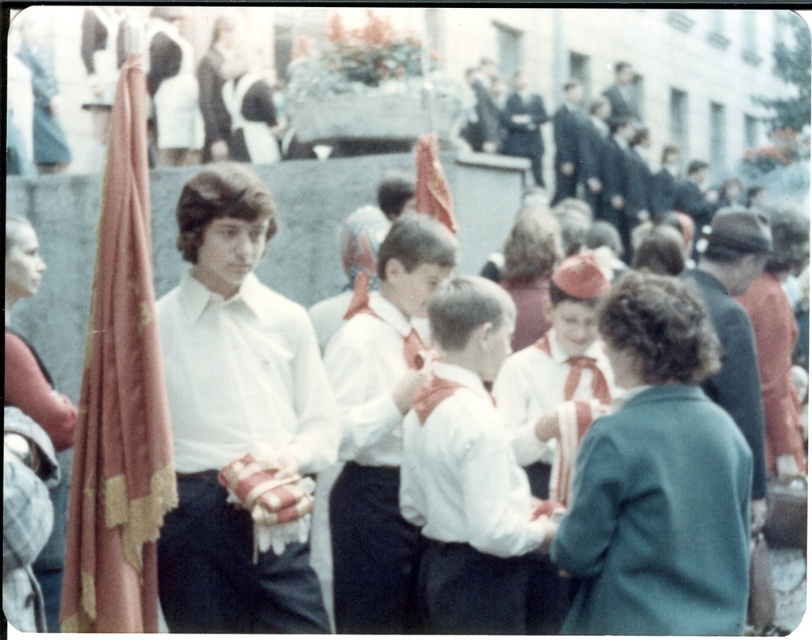
Question: Is green wool coat at center thinner than dark blue suit at upper center?

Choices:
 (A) yes
 (B) no

Answer: (B)

Question: Which object appears closest to the camera in this image?

Choices:
 (A) white satin bow tie at center
 (B) white cotton shirt at center
 (C) dark blue suit at center

Answer: (A)

Question: Which point is farther from the camera taking this photo?

Choices:
 (A) (441, 620)
 (B) (240, 349)
 (C) (340, 381)
 (D) (733, 388)

Answer: (D)

Question: Can you confirm if dark blue suit at upper center is positioned to the left of dark blue suit at center?

Choices:
 (A) no
 (B) yes

Answer: (B)

Question: Which point is closer to the camera?

Choices:
 (A) green wool coat at center
 (B) white matte shirt at center
 (C) white satin bow tie at center

Answer: (B)

Question: Is white cotton shirt at center positioned at the back of dark blue suit at upper center?

Choices:
 (A) yes
 (B) no

Answer: (B)